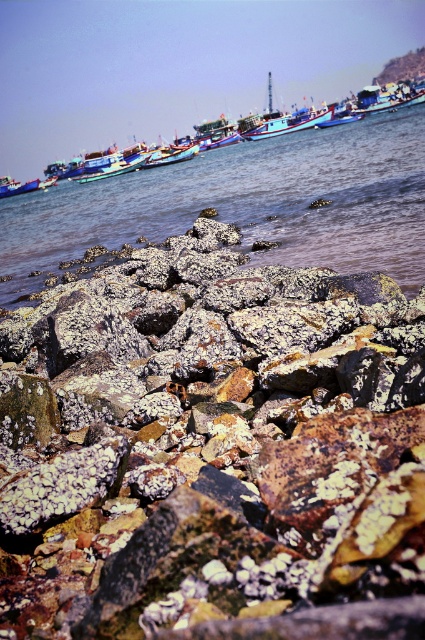
Can you confirm if metallic blue boat at center is shorter than blue painted wooden boat at center?

No, metallic blue boat at center is not shorter than blue painted wooden boat at center.

Where is `metallic blue boat at center`? metallic blue boat at center is located at coordinates (387, 97).

In order to click on metallic blue boat at center in this screenshot , I will do tap(387, 97).

Is clear water at center in front of metallic blue boat at left?

Yes, it is in front of metallic blue boat at left.

Is point (122, 184) farther from viewer compared to point (10, 189)?

No, (122, 184) is closer to viewer.

Locate an element on the screen. clear water at center is located at coordinates (248, 204).

Can you confirm if metallic blue boat at center is wider than metallic blue boat at left?

Yes.

Describe the element at coordinates (387, 97) in the screenshot. I see `metallic blue boat at center` at that location.

This screenshot has width=425, height=640. What are the coordinates of `metallic blue boat at center` in the screenshot? It's located at (387, 97).